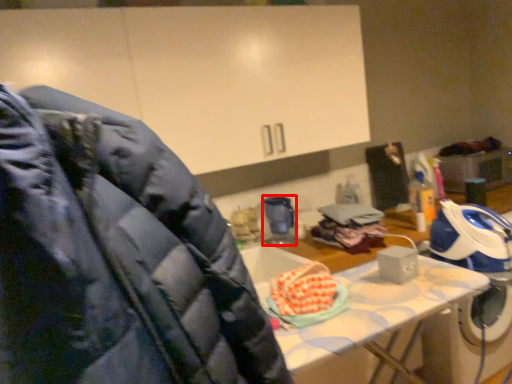
Question: From the image's perspective, what is the correct spatial positioning of appliance (annotated by the red box) in reference to person?

Choices:
 (A) above
 (B) below

Answer: (B)